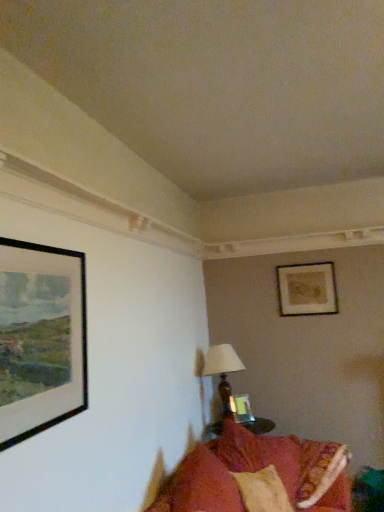
Question: Considering the relative sizes of black matte picture frame at left, positioned as the 2th picture frame in top-to-bottom order, and matte gold picture frame at upper right, acting as the 3th picture frame starting from the bottom, in the image provided, is black matte picture frame at left, positioned as the 2th picture frame in top-to-bottom order, bigger than matte gold picture frame at upper right, acting as the 3th picture frame starting from the bottom,?

Choices:
 (A) yes
 (B) no

Answer: (A)

Question: Is black matte picture frame at left, marked as the third picture frame in a back-to-front arrangement, facing away from matte gold picture frame at upper right, acting as the 3th picture frame starting from the bottom?

Choices:
 (A) no
 (B) yes

Answer: (A)

Question: From a real-world perspective, is black matte picture frame at left, which appears as the second picture frame when ordered from the bottom, positioned under matte gold picture frame at upper right, the third picture frame from the left, based on gravity?

Choices:
 (A) no
 (B) yes

Answer: (B)

Question: Can you see black matte picture frame at left, marked as the third picture frame in a back-to-front arrangement, touching matte gold picture frame at upper right, placed as the 1th picture frame when sorted from right to left?

Choices:
 (A) yes
 (B) no

Answer: (B)

Question: Considering the relative positions of black matte picture frame at left, which appears as the second picture frame when ordered from the bottom, and matte gold picture frame at upper right, placed as the 1th picture frame when sorted from right to left, in the image provided, is black matte picture frame at left, which appears as the second picture frame when ordered from the bottom, to the right of matte gold picture frame at upper right, placed as the 1th picture frame when sorted from right to left, from the viewer's perspective?

Choices:
 (A) no
 (B) yes

Answer: (A)

Question: Can you confirm if black matte picture frame at left, positioned as the 2th picture frame in top-to-bottom order, is shorter than matte gold picture frame at upper right, acting as the 3th picture frame starting from the bottom?

Choices:
 (A) no
 (B) yes

Answer: (A)

Question: Is matte brown table lamp at center at the right side of black matte picture frame at left, which appears as the first picture frame when viewed from the front?

Choices:
 (A) yes
 (B) no

Answer: (A)

Question: Is matte brown table lamp at center smaller than black matte picture frame at left, which appears as the second picture frame when ordered from the bottom?

Choices:
 (A) no
 (B) yes

Answer: (A)

Question: Is matte brown table lamp at center facing towards black matte picture frame at left, the first picture frame positioned from the left?

Choices:
 (A) yes
 (B) no

Answer: (B)

Question: From a real-world perspective, is matte brown table lamp at center beneath black matte picture frame at left, the 3th picture frame viewed from the right?

Choices:
 (A) no
 (B) yes

Answer: (B)

Question: Is matte brown table lamp at center with black matte picture frame at left, marked as the third picture frame in a back-to-front arrangement?

Choices:
 (A) no
 (B) yes

Answer: (A)

Question: Would you say matte brown table lamp at center is a long distance from black matte picture frame at left, marked as the third picture frame in a back-to-front arrangement?

Choices:
 (A) no
 (B) yes

Answer: (B)

Question: Can you confirm if matte glass picture frame at center, the second picture frame from the right, is smaller than black matte picture frame at left, the 3th picture frame viewed from the right?

Choices:
 (A) no
 (B) yes

Answer: (B)